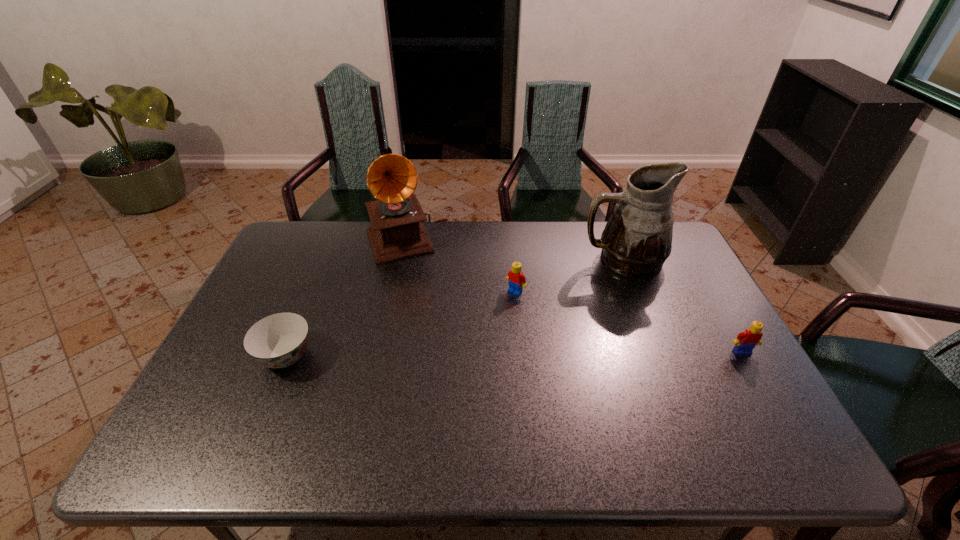
The width and height of the screenshot is (960, 540). Find the location of `vacant space on the desktop that is between the leftmost object and the rightmost object and is positioned on the horn of the second object from left to right`. vacant space on the desktop that is between the leftmost object and the rightmost object and is positioned on the horn of the second object from left to right is located at coordinates (449, 355).

Where is `free space on the desktop that is between the shortest object and the rightmost object and is positioned from the spout of the pitcher`? free space on the desktop that is between the shortest object and the rightmost object and is positioned from the spout of the pitcher is located at coordinates (478, 355).

This screenshot has height=540, width=960. I want to click on free space on the desktop that is between the soup bowl and the right Lego and is positioned on the face of the third nearest object, so click(454, 355).